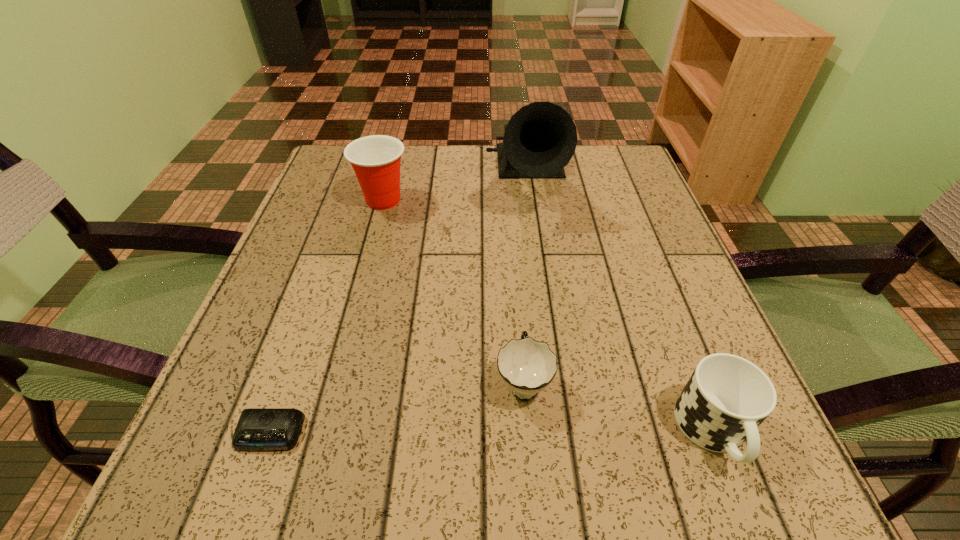
Where is `object that is at the far left corner`? object that is at the far left corner is located at coordinates (376, 159).

You are a GUI agent. You are given a task and a screenshot of the screen. Output one action in this format:
    pyautogui.click(x=<x>, y=<y>)
    Task: Click on the object located in the near left corner section of the desktop
    The width and height of the screenshot is (960, 540).
    Given the screenshot: What is the action you would take?
    pyautogui.click(x=258, y=429)

Image resolution: width=960 pixels, height=540 pixels. Find the location of `object at the near right corner`. object at the near right corner is located at coordinates (727, 397).

You are a GUI agent. You are given a task and a screenshot of the screen. Output one action in this format:
    pyautogui.click(x=<x>, y=<y>)
    Task: Click on the free location at the near edge of the desktop
    The width and height of the screenshot is (960, 540).
    Given the screenshot: What is the action you would take?
    pyautogui.click(x=375, y=487)

Locate an element on the screen. The image size is (960, 540). free space at the left edge of the desktop is located at coordinates (300, 230).

Identify the location of vacant region at the right edge of the desktop. This screenshot has height=540, width=960. (646, 215).

Where is `free space at the far right corner of the desktop`? free space at the far right corner of the desktop is located at coordinates click(x=603, y=174).

Where is `vacant region at the near right corner of the desktop`? The height and width of the screenshot is (540, 960). vacant region at the near right corner of the desktop is located at coordinates (745, 497).

Identify the location of free space that is in between the shortest object and the phonograph_record. (398, 307).

What are the coordinates of `vacant space in between the alarm clock and the second cup from right to left` in the screenshot? It's located at (396, 407).